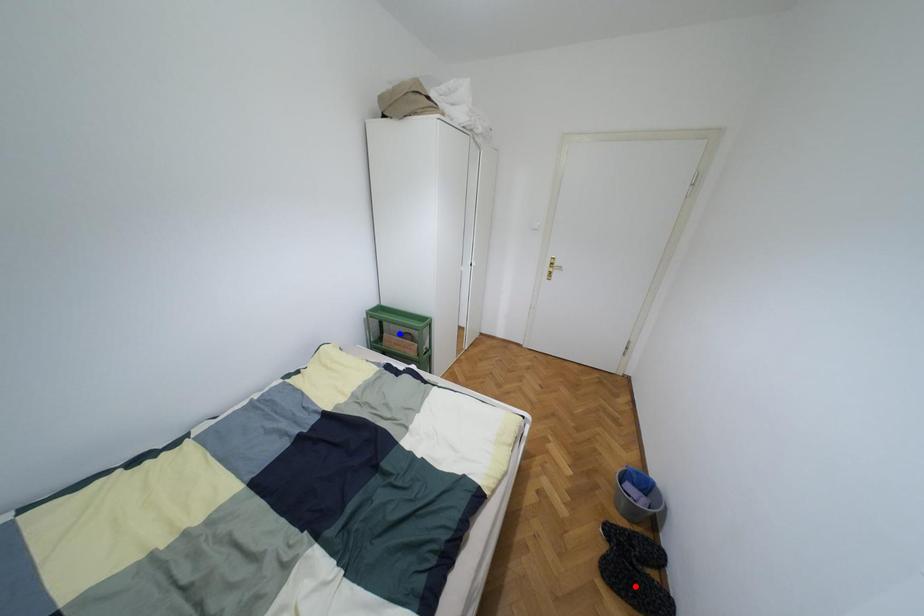
Question: Which of the two points in the image is closer to the camera?

Choices:
 (A) Blue point is closer.
 (B) Red point is closer.

Answer: (B)